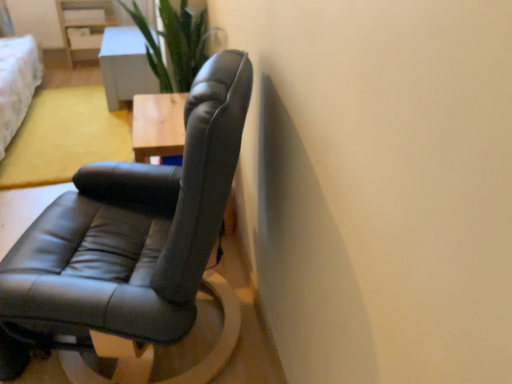
Where is `black leather chair at center`? black leather chair at center is located at coordinates (134, 229).

Describe the element at coordinates (134, 229) in the screenshot. I see `black leather chair at center` at that location.

The width and height of the screenshot is (512, 384). Describe the element at coordinates (125, 66) in the screenshot. I see `light gray wooden table at upper center` at that location.

The height and width of the screenshot is (384, 512). What are the coordinates of `light gray wooden table at upper center` in the screenshot? It's located at (125, 66).

Where is `black leather chair at center`? The height and width of the screenshot is (384, 512). black leather chair at center is located at coordinates (134, 229).

Which object is positioned more to the right, light gray wooden table at upper center or black leather chair at center?

From the viewer's perspective, black leather chair at center appears more on the right side.

Consider the image. Is light gray wooden table at upper center positioned before black leather chair at center?

No, it is behind black leather chair at center.

Does point (114, 64) come farther from viewer compared to point (45, 226)?

Yes, point (114, 64) is farther from viewer.

Based on the photo, from the image's perspective, between light gray wooden table at upper center and black leather chair at center, who is located below?

black leather chair at center, from the image's perspective.

From a real-world perspective, who is located lower, light gray wooden table at upper center or black leather chair at center?

light gray wooden table at upper center, from a real-world perspective.

Does light gray wooden table at upper center have a lesser width compared to black leather chair at center?

Result: Indeed, light gray wooden table at upper center has a lesser width compared to black leather chair at center.

Is light gray wooden table at upper center taller or shorter than black leather chair at center?

In the image, light gray wooden table at upper center appears to be shorter than black leather chair at center.

Between light gray wooden table at upper center and black leather chair at center, which one has larger size?

With larger size is black leather chair at center.

Consider the image. Is light gray wooden table at upper center positioned beyond the bounds of black leather chair at center?

Yes, light gray wooden table at upper center is not within black leather chair at center.

Is light gray wooden table at upper center next to black leather chair at center and touching it?

No, light gray wooden table at upper center is not in contact with black leather chair at center.

Is light gray wooden table at upper center facing away from black leather chair at center?

light gray wooden table at upper center does not have its back to black leather chair at center.

How different are the orientations of light gray wooden table at upper center and black leather chair at center in degrees?

The angle between the facing direction of light gray wooden table at upper center and the facing direction of black leather chair at center is 16.7 degrees.

The width and height of the screenshot is (512, 384). What are the coordinates of `table located on the left of black leather chair at center` in the screenshot? It's located at (125, 66).

Can you confirm if black leather chair at center is positioned to the right of light gray wooden table at upper center?

Indeed, black leather chair at center is positioned on the right side of light gray wooden table at upper center.

Who is more distant, black leather chair at center or light gray wooden table at upper center?

light gray wooden table at upper center is further away from the camera.

Which is less distant, (201, 181) or (114, 34)?

Point (201, 181) is positioned closer to the camera compared to point (114, 34).

From the image's perspective, which is above, black leather chair at center or light gray wooden table at upper center?

light gray wooden table at upper center, from the image's perspective.

From a real-world perspective, is black leather chair at center under light gray wooden table at upper center?

No, from a real-world perspective, black leather chair at center is not under light gray wooden table at upper center.

In terms of width, does black leather chair at center look wider or thinner when compared to light gray wooden table at upper center?

In the image, black leather chair at center appears to be wider than light gray wooden table at upper center.

Considering the sizes of objects black leather chair at center and light gray wooden table at upper center in the image provided, who is shorter, black leather chair at center or light gray wooden table at upper center?

With less height is light gray wooden table at upper center.

Between black leather chair at center and light gray wooden table at upper center, which one has larger size?

With larger size is black leather chair at center.

In the scene shown: Choose the correct answer: Is black leather chair at center inside light gray wooden table at upper center or outside it?

black leather chair at center is spatially situated outside light gray wooden table at upper center.

Is black leather chair at center in contact with light gray wooden table at upper center?

black leather chair at center and light gray wooden table at upper center are not in contact.

Is black leather chair at center facing away from light gray wooden table at upper center?

No, black leather chair at center is not facing the opposite direction of light gray wooden table at upper center.

Find the location of a particular element. table behind the black leather chair at center is located at coordinates (125, 66).

Where is `chair in front of the light gray wooden table at upper center`? chair in front of the light gray wooden table at upper center is located at coordinates [134, 229].

Image resolution: width=512 pixels, height=384 pixels. Find the location of `chair above the light gray wooden table at upper center (from a real-world perspective)`. chair above the light gray wooden table at upper center (from a real-world perspective) is located at coordinates (134, 229).